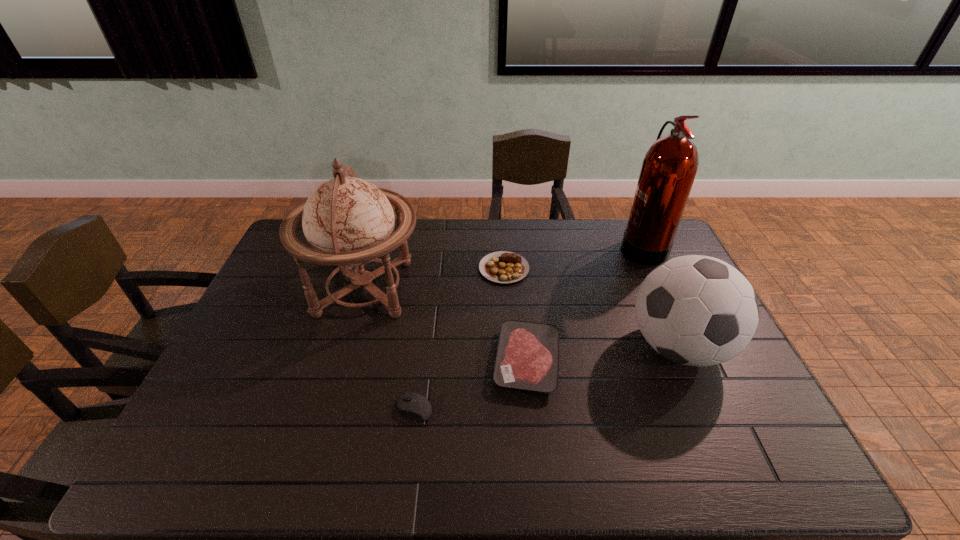
I want to click on fire extinguisher, so click(669, 168).

Where is `globe`? The height and width of the screenshot is (540, 960). globe is located at coordinates (348, 222).

Where is `the third tallest object`? the third tallest object is located at coordinates (695, 310).

The height and width of the screenshot is (540, 960). I want to click on the farther steak, so click(x=504, y=267).

This screenshot has width=960, height=540. Identify the location of the nearer steak. (527, 358).

Where is `computer equipment`? Image resolution: width=960 pixels, height=540 pixels. computer equipment is located at coordinates (414, 406).

You are a GUI agent. You are given a task and a screenshot of the screen. Output one action in this format:
    pyautogui.click(x=<x>, y=<y>)
    Task: Click on the vacant position located on the front-facing side of the fire extinguisher
    This screenshot has height=540, width=960.
    Given the screenshot: What is the action you would take?
    pyautogui.click(x=572, y=246)

The height and width of the screenshot is (540, 960). I want to click on free spot located 0.270m on the front-facing side of the fire extinguisher, so click(545, 246).

Locate an element on the screen. Image resolution: width=960 pixels, height=540 pixels. free region located on the front-facing side of the fire extinguisher is located at coordinates (559, 246).

This screenshot has width=960, height=540. I want to click on vacant space located at the front of the globe showing Africa, so click(439, 288).